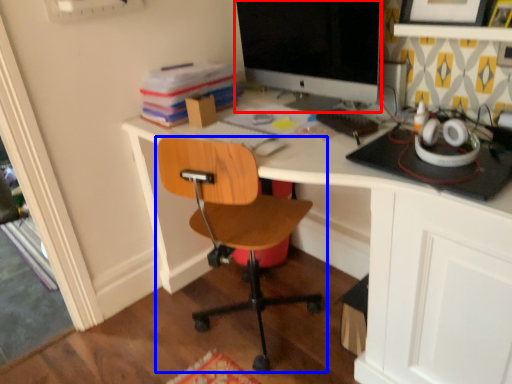
Question: Among these objects, which one is nearest to the camera, computer monitor (highlighted by a red box) or chair (highlighted by a blue box)?

Choices:
 (A) computer monitor
 (B) chair

Answer: (B)